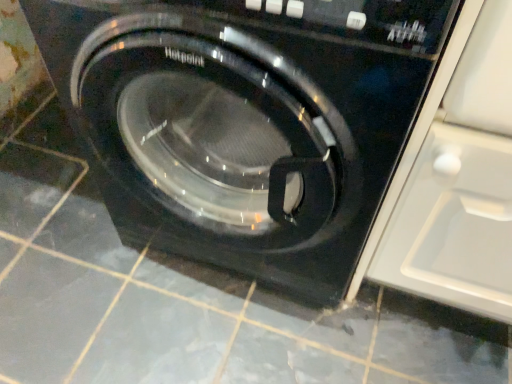
Question: Should I look upward or downward to see black glossy washing machine at center?

Choices:
 (A) up
 (B) down

Answer: (A)

Question: Considering the relative sizes of transparent glossy glass door at right and black glossy washing machine at center in the image provided, is transparent glossy glass door at right taller than black glossy washing machine at center?

Choices:
 (A) yes
 (B) no

Answer: (B)

Question: Is transparent glossy glass door at right not within black glossy washing machine at center?

Choices:
 (A) no
 (B) yes

Answer: (B)

Question: Is transparent glossy glass door at right turned away from black glossy washing machine at center?

Choices:
 (A) no
 (B) yes

Answer: (A)

Question: Is black glossy washing machine at center inside transparent glossy glass door at right?

Choices:
 (A) no
 (B) yes

Answer: (A)

Question: Could you tell me if transparent glossy glass door at right is facing black glossy washing machine at center?

Choices:
 (A) no
 (B) yes

Answer: (A)

Question: Is transparent glossy glass door at right beside black glossy washing machine at center?

Choices:
 (A) no
 (B) yes

Answer: (A)

Question: Is black glossy washing machine at center surrounding transparent glossy glass door at right?

Choices:
 (A) yes
 (B) no

Answer: (B)

Question: From a real-world perspective, does black glossy washing machine at center sit lower than transparent glossy glass door at right?

Choices:
 (A) yes
 (B) no

Answer: (B)

Question: From the image's perspective, would you say black glossy washing machine at center is positioned over transparent glossy glass door at right?

Choices:
 (A) no
 (B) yes

Answer: (B)

Question: Is black glossy washing machine at center at the left side of transparent glossy glass door at right?

Choices:
 (A) no
 (B) yes

Answer: (B)

Question: Is black glossy washing machine at center at the right side of transparent glossy glass door at right?

Choices:
 (A) yes
 (B) no

Answer: (B)

Question: Can you see black glossy washing machine at center touching transparent glossy glass door at right?

Choices:
 (A) yes
 (B) no

Answer: (B)

Question: Is transparent glossy glass door at right inside or outside of black glossy washing machine at center?

Choices:
 (A) inside
 (B) outside

Answer: (B)